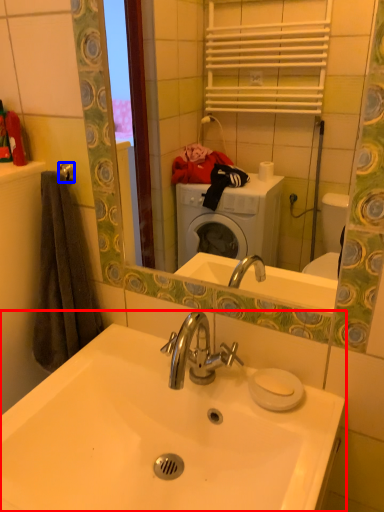
Question: Which object is further to the camera taking this photo, sink (highlighted by a red box) or towel bar (highlighted by a blue box)?

Choices:
 (A) sink
 (B) towel bar

Answer: (B)